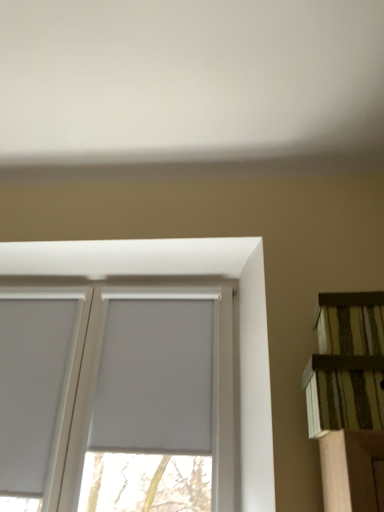
At what (x,y) coordinates should I click in order to perform the action: click on white matte window at center. Please return your answer as a coordinate pair (x, y). The height and width of the screenshot is (512, 384). Looking at the image, I should click on [186, 275].

Is white matte window screen at center at the right side of striped fabric shelf at right?

Incorrect, white matte window screen at center is not on the right side of striped fabric shelf at right.

Is striped fabric shelf at right inside white matte window screen at center?

No, striped fabric shelf at right is not a part of white matte window screen at center.

Could you tell me if white matte window screen at center is facing striped fabric shelf at right?

No.

You are a GUI agent. You are given a task and a screenshot of the screen. Output one action in this format:
    pyautogui.click(x=<x>, y=<y>)
    Task: Click on the shelf in front of the white matte window screen at center
    The image size is (384, 512).
    Given the screenshot: What is the action you would take?
    pyautogui.click(x=347, y=365)

How many degrees apart are the facing directions of striped fabric shelf at right and white matte window screen at center?

1.25 degrees separate the facing orientations of striped fabric shelf at right and white matte window screen at center.

Is striped fabric shelf at right completely or partially outside of white matte window screen at center?

Yes.

Is striped fabric shelf at right in front of or behind white matte window screen at center in the image?

striped fabric shelf at right is positioned closer to the viewer than white matte window screen at center.

Does point (254, 287) lie in front of point (105, 436)?

Yes.

Is white matte window at center completely or partially outside of white matte window screen at center?

Yes, white matte window at center is located beyond the bounds of white matte window screen at center.

Between white matte window at center and white matte window screen at center, which one is positioned in front?

white matte window at center is in front.

Are striped fabric shelf at right and white matte window at center far apart?

striped fabric shelf at right is near white matte window at center, not far away.

How different are the orientations of striped fabric shelf at right and white matte window at center in degrees?

The angular difference between striped fabric shelf at right and white matte window at center is 0.562 degrees.

Which is nearer, (376, 394) or (262, 366)?

The point (376, 394) is closer.

Is striped fabric shelf at right wider than white matte window at center?

Indeed, striped fabric shelf at right has a greater width compared to white matte window at center.

Is point (65, 264) farther from viewer compared to point (357, 390)?

Yes, it is.

Is white matte window at center outside of striped fabric shelf at right?

Yes.

Between white matte window at center and striped fabric shelf at right, which one has larger size?

With larger size is white matte window at center.

Based on the photo, from the image's perspective, is white matte window at center located above or below striped fabric shelf at right?

Clearly, from the image's perspective, white matte window at center is below striped fabric shelf at right.

This screenshot has height=512, width=384. What are the coordinates of `window in front of the white matte window screen at center` in the screenshot? It's located at (186, 275).

Is white matte window screen at center spatially inside white matte window at center, or outside of it?

white matte window screen at center is located inside white matte window at center.

Is white matte window screen at center bigger or smaller than white matte window at center?

In the image, white matte window screen at center appears to be smaller than white matte window at center.

How different are the orientations of white matte window screen at center and white matte window at center in degrees?

There is a 1.81-degree angle between the facing directions of white matte window screen at center and white matte window at center.

The image size is (384, 512). I want to click on window screen located below the striped fabric shelf at right (from the image's perspective), so click(x=155, y=378).

Where is `shelf below the white matte window screen at center (from a real-world perspective)`? shelf below the white matte window screen at center (from a real-world perspective) is located at coordinates (347, 365).

Considering their positions, is white matte window screen at center positioned closer to striped fabric shelf at right than white matte window at center?

Among the two, white matte window at center is located nearer to striped fabric shelf at right.

When comparing their distances from white matte window at center, does striped fabric shelf at right or white matte window screen at center seem further?

Among the two, striped fabric shelf at right is located further to white matte window at center.

When comparing their distances from white matte window at center, does white matte window screen at center or striped fabric shelf at right seem further?

striped fabric shelf at right.

From the image, which object appears to be nearer to white matte window screen at center, white matte window at center or striped fabric shelf at right?

white matte window at center is closer to white matte window screen at center.

From the image, which object appears to be nearer to white matte window screen at center, striped fabric shelf at right or white matte window at center?

white matte window at center is closer to white matte window screen at center.

Looking at the image, which one is located further to striped fabric shelf at right, white matte window at center or white matte window screen at center?

white matte window screen at center is positioned further to the anchor striped fabric shelf at right.

This screenshot has height=512, width=384. Identify the location of window screen located between white matte window at center and striped fabric shelf at right in the left-right direction. (155, 378).